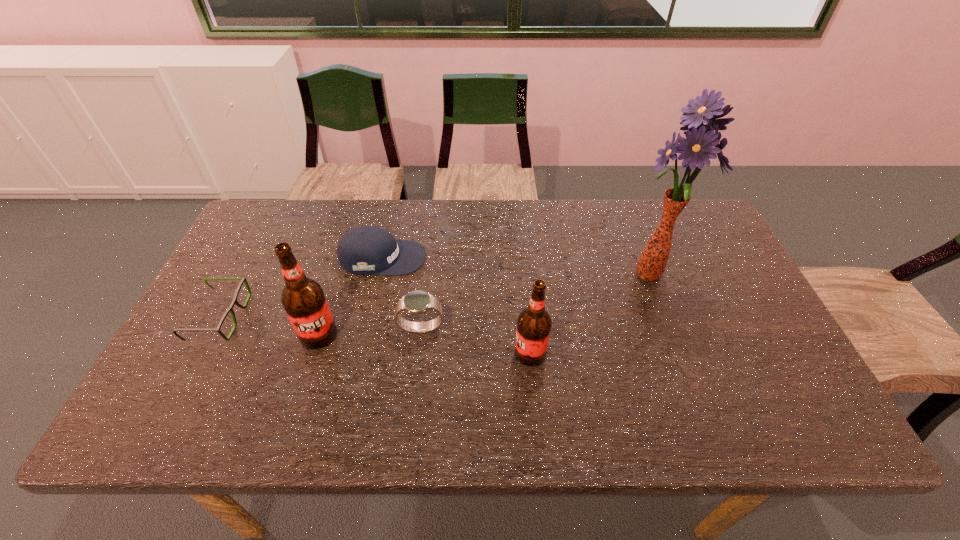
The image size is (960, 540). In order to click on vacant space at the left edge of the desktop in this screenshot , I will do `click(249, 261)`.

Find the location of a particular element. This screenshot has height=540, width=960. free space at the right edge of the desktop is located at coordinates (723, 352).

What are the coordinates of `vacant space that is in between the shorter root beer and the baseball cap` in the screenshot? It's located at (456, 306).

Identify the location of free space between the baseball cap and the fifth shortest object. The width and height of the screenshot is (960, 540). (350, 296).

The height and width of the screenshot is (540, 960). Find the location of `unoccupied area between the second object from right to left and the rightmost object`. unoccupied area between the second object from right to left and the rightmost object is located at coordinates (588, 314).

Where is `empty space between the rightmost object and the baseball cap`? This screenshot has height=540, width=960. empty space between the rightmost object and the baseball cap is located at coordinates (515, 267).

Locate an element on the screen. The height and width of the screenshot is (540, 960). vacant region between the right root beer and the watch is located at coordinates (475, 341).

I want to click on free point between the right root beer and the fifth shortest object, so click(424, 345).

Find the location of a particular element. Image resolution: width=960 pixels, height=540 pixels. empty location between the baseball cap and the watch is located at coordinates (402, 293).

Locate an element on the screen. This screenshot has height=540, width=960. empty space between the baseball cap and the flower arrangement is located at coordinates (515, 267).